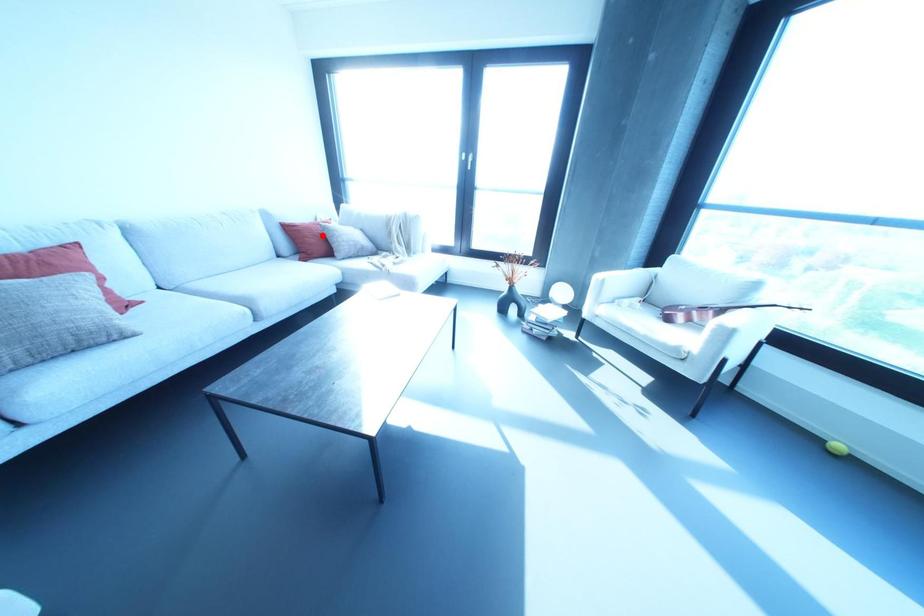
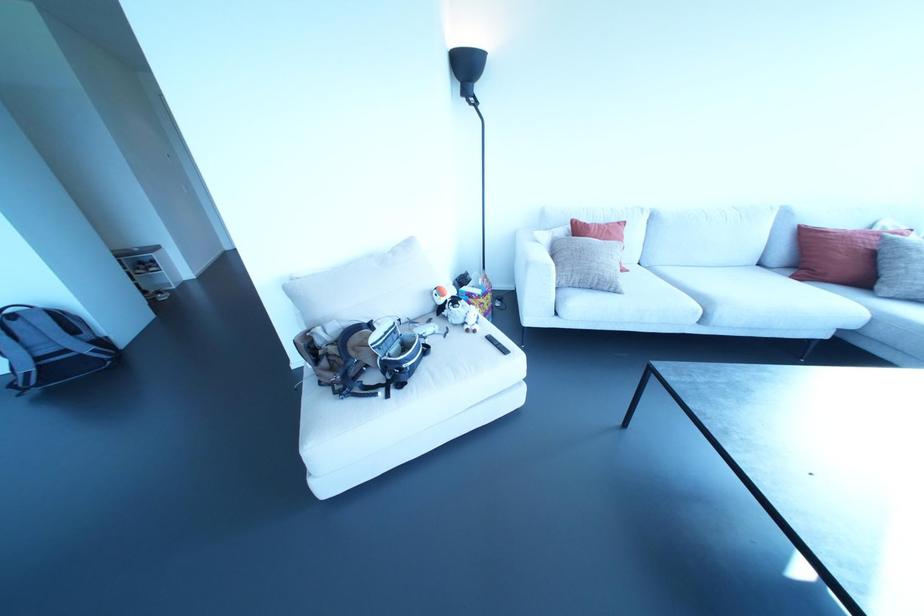
Question: A red point is marked in image1. In image2, is the corresponding 3D point closer to the camera or farther? Reply with the corresponding letter.

Choices:
 (A) The corresponding 3D point is closer.
 (B) The corresponding 3D point is farther.

Answer: (B)